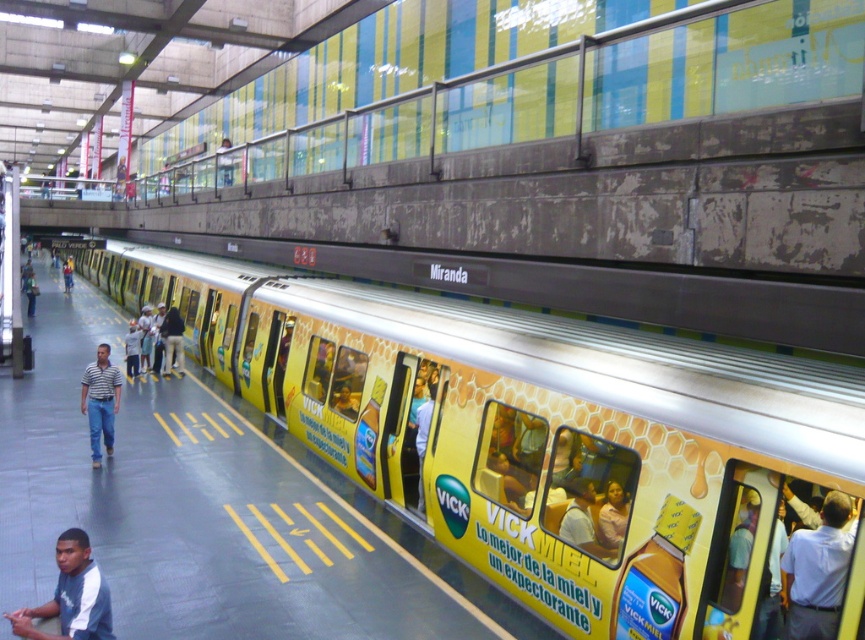
Between point (82, 540) and point (91, 451), which one is positioned in front?

Positioned in front is point (82, 540).

Between blue jersey at lower left and striped cotton shirt at center, which one appears on the left side from the viewer's perspective?

From the viewer's perspective, striped cotton shirt at center appears more on the left side.

Is point (101, 605) positioned before point (85, 380)?

Yes, point (101, 605) is in front of point (85, 380).

The height and width of the screenshot is (640, 865). What are the coordinates of `blue jersey at lower left` in the screenshot? It's located at (x=69, y=596).

Describe the element at coordinates (818, 572) in the screenshot. The width and height of the screenshot is (865, 640). I see `white shirt at center` at that location.

Who is more distant from viewer, [833,499] or [90,609]?

The point [833,499] is more distant.

Find the location of a particular element. This screenshot has height=640, width=865. white shirt at center is located at coordinates pyautogui.click(x=818, y=572).

How far apart are blue jersey at lower left and light blue jeans at center?

The distance of blue jersey at lower left from light blue jeans at center is 13.07 meters.

Can you confirm if blue jersey at lower left is positioned to the right of light blue jeans at center?

Yes, blue jersey at lower left is to the right of light blue jeans at center.

Between point (54, 604) and point (163, 356), which one is positioned behind?

Point (163, 356)

The height and width of the screenshot is (640, 865). What are the coordinates of `blue jersey at lower left` in the screenshot? It's located at (69, 596).